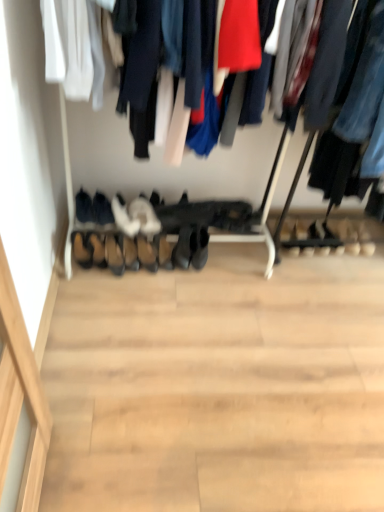
Question: From a real-world perspective, is brown leather shoe at lower center, which appears as the second shoe when viewed from the left, physically above white suede shoes at center, which is the fifth footwear from left to right?

Choices:
 (A) yes
 (B) no

Answer: (B)

Question: Is brown leather shoe at lower center, which is the third shoe in right-to-left order, positioned far away from white suede shoes at center, which is the 2th footwear in right-to-left order?

Choices:
 (A) yes
 (B) no

Answer: (B)

Question: Is the depth of brown leather shoe at lower center, which appears as the second shoe when viewed from the left, less than that of white suede shoes at center, which is the 2th footwear in right-to-left order?

Choices:
 (A) yes
 (B) no

Answer: (A)

Question: Is white suede shoes at center, which is the fifth footwear from left to right, at the back of brown leather shoe at lower center, which is the third shoe in right-to-left order?

Choices:
 (A) no
 (B) yes

Answer: (A)

Question: Considering the relative sizes of brown leather shoe at lower center, which appears as the second shoe when viewed from the left, and white suede shoes at center, which is the 2th footwear in right-to-left order, in the image provided, is brown leather shoe at lower center, which appears as the second shoe when viewed from the left, shorter than white suede shoes at center, which is the 2th footwear in right-to-left order,?

Choices:
 (A) yes
 (B) no

Answer: (B)

Question: Is brown leather shoe at lower center, which is the third shoe in right-to-left order, taller or shorter than white suede shoes at center, which is the fifth footwear from left to right?

Choices:
 (A) tall
 (B) short

Answer: (A)

Question: Relative to white suede shoes at center, which is the 2th footwear in right-to-left order, is brown leather shoe at lower center, which is the third shoe in right-to-left order, in front or behind?

Choices:
 (A) behind
 (B) front

Answer: (B)

Question: From a real-world perspective, is brown leather shoe at lower center, which is the third shoe in right-to-left order, physically located above or below white suede shoes at center, which is the 2th footwear in right-to-left order?

Choices:
 (A) below
 (B) above

Answer: (A)

Question: Considering the positions of brown leather shoe at lower center, which appears as the second shoe when viewed from the left, and white suede shoes at center, which is the fifth footwear from left to right, in the image, is brown leather shoe at lower center, which appears as the second shoe when viewed from the left, wider or thinner than white suede shoes at center, which is the fifth footwear from left to right,?

Choices:
 (A) thin
 (B) wide

Answer: (A)

Question: Based on their sizes in the image, would you say white suede shoes at center, which is the fifth footwear from left to right, is bigger or smaller than leather at center, which ranks as the 1th shoe in right-to-left order?

Choices:
 (A) small
 (B) big

Answer: (B)

Question: Based on their positions, is white suede shoes at center, which is the fifth footwear from left to right, located to the left or right of leather at center, the fourth shoe in the left-to-right sequence?

Choices:
 (A) left
 (B) right

Answer: (A)

Question: Considering the positions of white suede shoes at center, which is the fifth footwear from left to right, and leather at center, which ranks as the 1th shoe in right-to-left order, in the image, is white suede shoes at center, which is the fifth footwear from left to right, taller or shorter than leather at center, which ranks as the 1th shoe in right-to-left order,?

Choices:
 (A) short
 (B) tall

Answer: (A)

Question: From the image's perspective, is white suede shoes at center, which is the 2th footwear in right-to-left order, positioned above or below leather at center, the fourth shoe in the left-to-right sequence?

Choices:
 (A) below
 (B) above

Answer: (B)

Question: From the image's perspective, relative to brown leather shoe at lower center, which is the third shoe in right-to-left order, is leather shoes at center, the third shoe from the left, above or below?

Choices:
 (A) below
 (B) above

Answer: (A)

Question: From a real-world perspective, is leather shoes at center, the 2th shoe positioned from the right, above or below brown leather shoe at lower center, which appears as the second shoe when viewed from the left?

Choices:
 (A) above
 (B) below

Answer: (B)